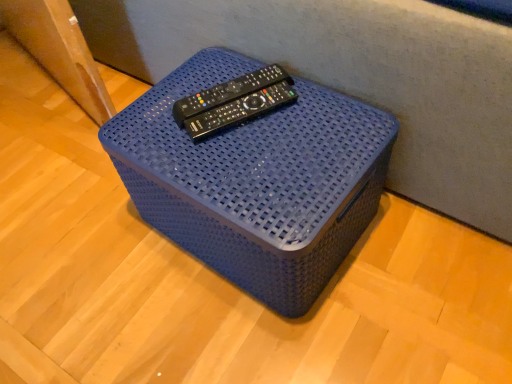
Find the location of a particular element. This screenshot has width=512, height=384. blank space to the left of black plastic remote at center is located at coordinates (160, 110).